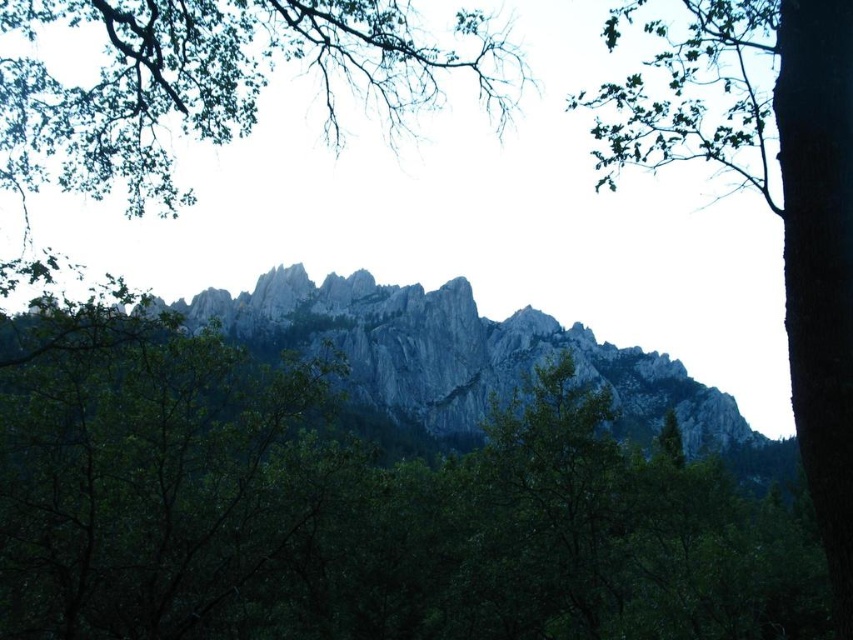
Question: Is green leafy tree at upper right behind rugged stone mountain at center?

Choices:
 (A) yes
 (B) no

Answer: (B)

Question: Which point is closer to the camera taking this photo?

Choices:
 (A) [x=328, y=42]
 (B) [x=715, y=19]

Answer: (A)

Question: Is green leafy tree at upper center bigger than green leafy tree at upper right?

Choices:
 (A) no
 (B) yes

Answer: (A)

Question: Which object is positioned closest to the green leafy tree at upper center?

Choices:
 (A) green leafy tree at upper right
 (B) rugged stone mountain at center

Answer: (B)

Question: Which of these objects is positioned farthest from the green leafy tree at upper right?

Choices:
 (A) rugged stone mountain at center
 (B) green leafy tree at upper center

Answer: (B)

Question: Does green leafy tree at upper center have a smaller size compared to rugged stone mountain at center?

Choices:
 (A) yes
 (B) no

Answer: (B)